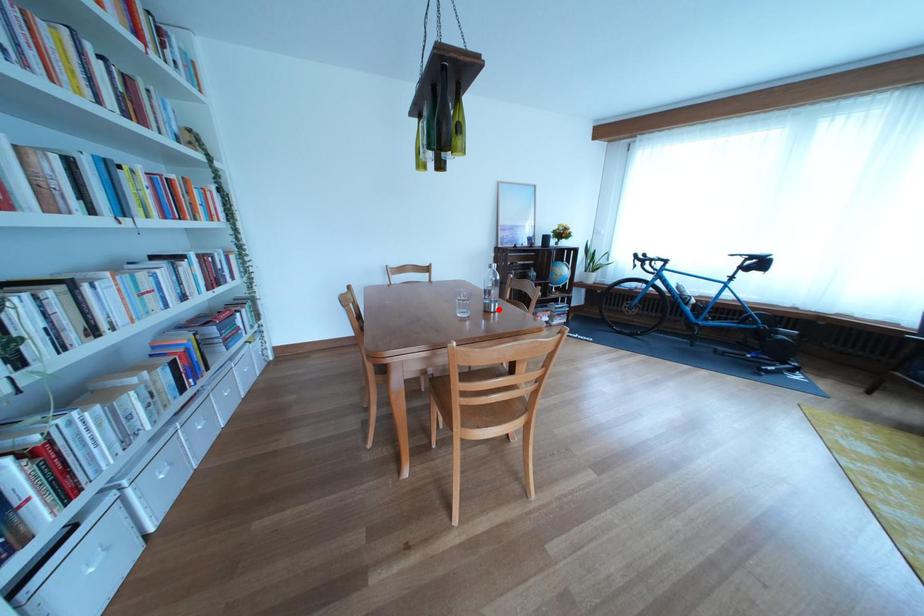
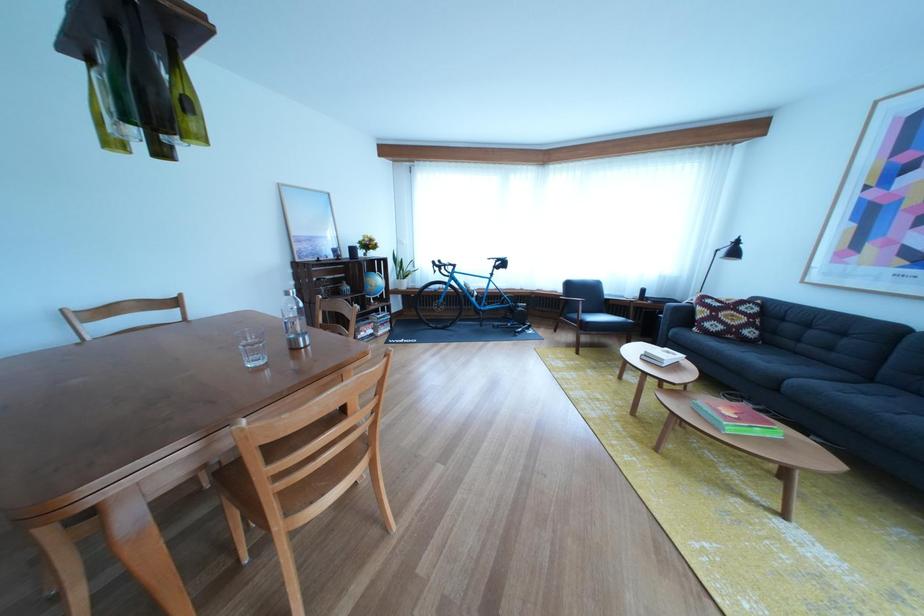
Question: I am providing you with two images of the same scene from different viewpoints. A red point is marked on the first image. At the location where the point appears in image 1, is it still visible in image 2?

Choices:
 (A) Yes
 (B) No

Answer: (A)